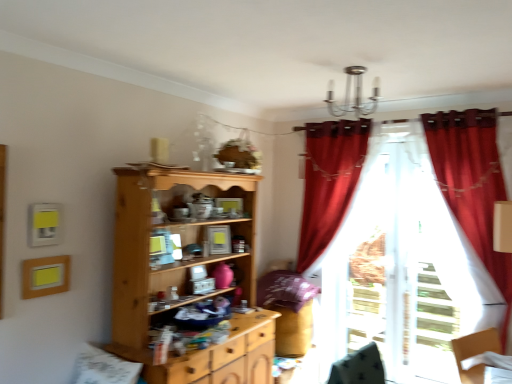
Question: Looking at their shapes, would you say velvet red curtain at right, the second curtain when ordered from back to front, is wider or thinner than light wood cupboard at center?

Choices:
 (A) thin
 (B) wide

Answer: (A)

Question: Is velvet red curtain at right, which ranks as the first curtain in front-to-back order, inside the boundaries of light wood cupboard at center, or outside?

Choices:
 (A) outside
 (B) inside

Answer: (A)

Question: Which object is positioned closest to the velvet red curtain at right, the second curtain when ordered from back to front?

Choices:
 (A) translucent white curtain at right, which appears as the first curtain when viewed from the back
 (B) light wood cupboard at center

Answer: (A)

Question: Which of these objects is positioned farthest from the translucent white curtain at right, which appears as the first curtain when viewed from the back?

Choices:
 (A) velvet red curtain at right, the second curtain when ordered from back to front
 (B) light wood cupboard at center

Answer: (B)